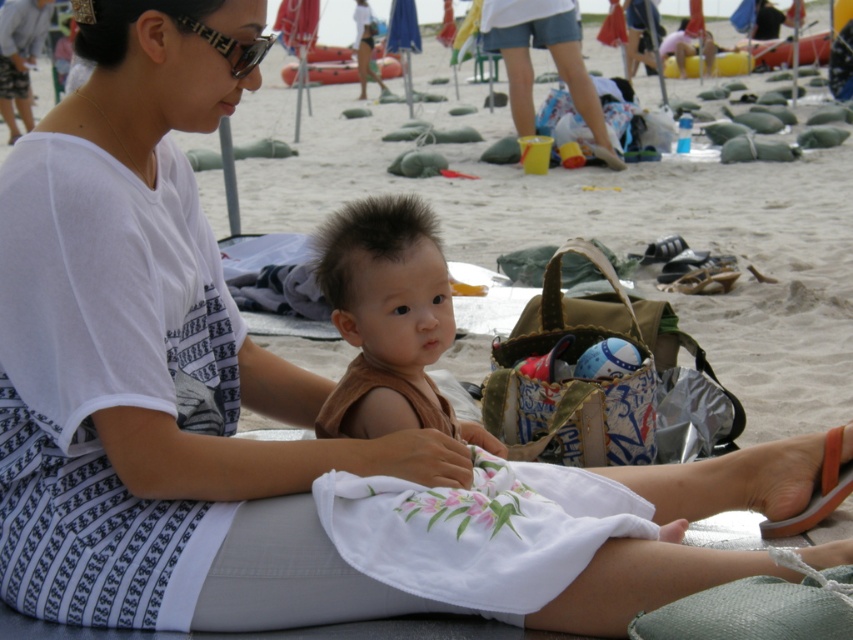
What is the 2D coordinate of the brown cotton shirt at center?

The brown cotton shirt at center is located at the 2D coordinate point of (x=386, y=317).

You are a beachgoer who wants to choose between the brown cotton shirt at center and the white cotton dress at center. Which one is shorter?

The brown cotton shirt at center is shorter than the white cotton dress at center.